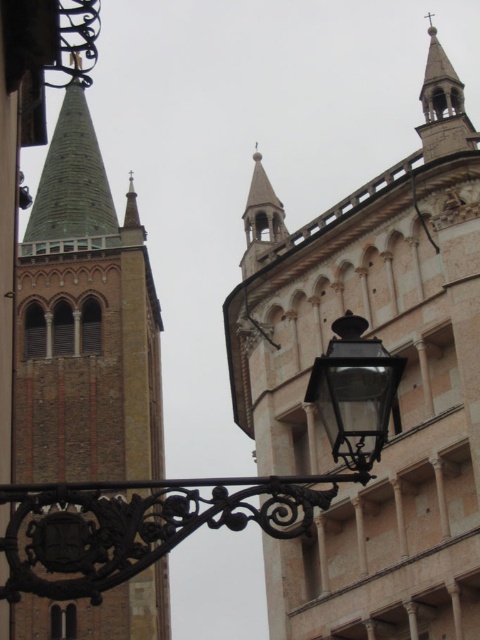
Locate an element on the screen. Image resolution: width=480 pixels, height=640 pixels. smooth beige tower at center is located at coordinates (398, 388).

Who is shorter, smooth beige tower at center or green stone tower at left?

smooth beige tower at center is shorter.

Is point (303, 618) positioned in front of point (25, 276)?

That is True.

You are a GUI agent. You are given a task and a screenshot of the screen. Output one action in this format:
    pyautogui.click(x=<x>, y=<y>)
    Task: Click on the smooth beige tower at center
    This screenshot has width=480, height=640.
    Given the screenshot: What is the action you would take?
    point(398,388)

Does green stone tower at left appear on the right side of black wrought iron street light at center?

In fact, green stone tower at left is to the left of black wrought iron street light at center.

Is point (109, 268) positioned before point (98, 492)?

No, it is not.

Image resolution: width=480 pixels, height=640 pixels. Find the location of `green stone tower at left`. green stone tower at left is located at coordinates (71, 278).

Which is more to the left, smooth beige tower at center or black wrought iron street light at center?

Positioned to the left is black wrought iron street light at center.

Is point (327, 324) positioned after point (41, 579)?

Yes.

Find the location of a particular element. smooth beige tower at center is located at coordinates (398, 388).